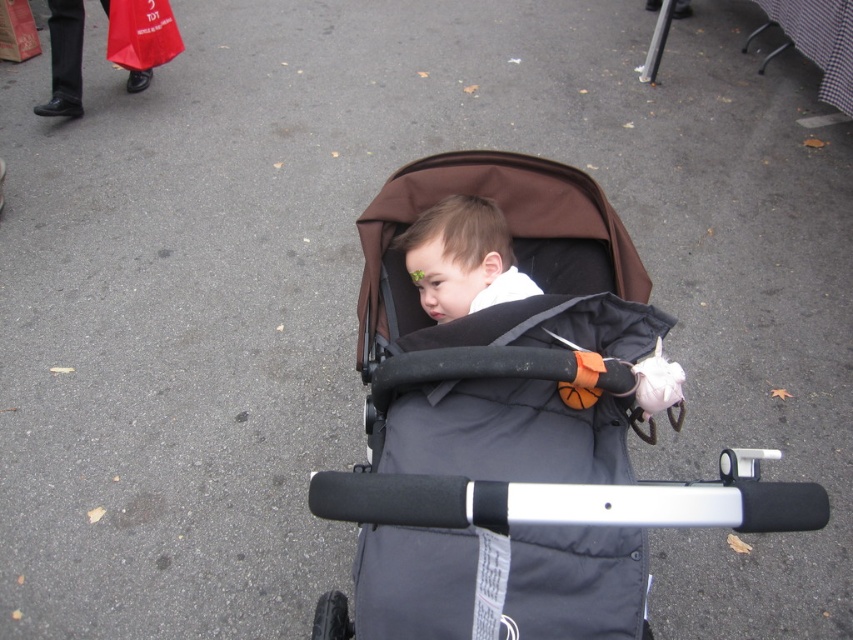
You are a delivery robot trying to navigate around the stroller. The stroller is at the center of the image. There is a point at coordinates point (x=518, y=428). Is this point located on the black fabric baby carriage at center?

The point (x=518, y=428) is on the black fabric baby carriage at center, so yes, the point is located on the stroller.

You are a delivery person who needs to navigate through the area shown in the image. There is a black fabric baby carriage at center and a matte black toddler at center in your path. Which object should you avoid hitting first while moving forward?

The matte black toddler at center should be avoided first since the black fabric baby carriage at center is positioned to the right of it, meaning the toddler is closer to your path.

You are a delivery robot with a 12 inch wide package. You need to navigate between the black fabric baby carriage at center and the matte black toddler at center. Can you fit through the space between them?

The distance between the black fabric baby carriage at center and the matte black toddler at center is 6.82 inches, which is narrower than the 12 inch wide package. Therefore, the delivery robot cannot fit through the space between them.